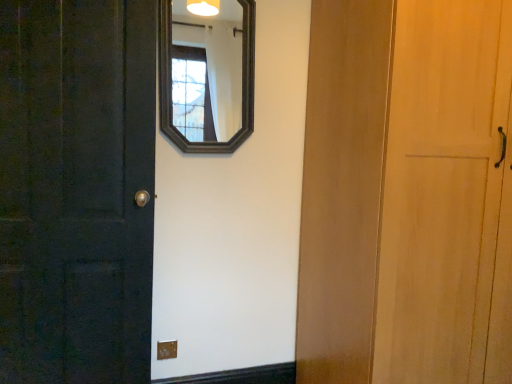
Question: Considering the relative sizes of matte black door at left and matte brown outlet at lower center in the image provided, is matte black door at left smaller than matte brown outlet at lower center?

Choices:
 (A) yes
 (B) no

Answer: (B)

Question: Does matte black door at left have a larger size compared to matte brown outlet at lower center?

Choices:
 (A) yes
 (B) no

Answer: (A)

Question: Considering the relative sizes of matte black door at left and matte brown outlet at lower center in the image provided, is matte black door at left taller than matte brown outlet at lower center?

Choices:
 (A) no
 (B) yes

Answer: (B)

Question: Can you confirm if matte black door at left is positioned to the left of matte brown outlet at lower center?

Choices:
 (A) no
 (B) yes

Answer: (B)

Question: From the image's perspective, is matte black door at left on top of matte brown outlet at lower center?

Choices:
 (A) yes
 (B) no

Answer: (A)

Question: In the image, is matte brown outlet at lower center positioned in front of or behind dark wood mirror at upper center?

Choices:
 (A) behind
 (B) front

Answer: (A)

Question: From a real-world perspective, is matte brown outlet at lower center physically located above or below dark wood mirror at upper center?

Choices:
 (A) above
 (B) below

Answer: (B)

Question: Is matte brown outlet at lower center to the left or to the right of dark wood mirror at upper center in the image?

Choices:
 (A) left
 (B) right

Answer: (A)

Question: Considering the positions of point (176, 344) and point (224, 59), is point (176, 344) closer or farther from the camera than point (224, 59)?

Choices:
 (A) closer
 (B) farther

Answer: (A)

Question: Is matte black door at left bigger or smaller than matte brown outlet at lower center?

Choices:
 (A) big
 (B) small

Answer: (A)

Question: Do you think matte black door at left is within matte brown outlet at lower center, or outside of it?

Choices:
 (A) inside
 (B) outside

Answer: (B)

Question: Considering the positions of matte black door at left and matte brown outlet at lower center in the image, is matte black door at left wider or thinner than matte brown outlet at lower center?

Choices:
 (A) thin
 (B) wide

Answer: (B)

Question: In the image, is matte black door at left on the left side or the right side of matte brown outlet at lower center?

Choices:
 (A) right
 (B) left

Answer: (B)

Question: Is matte brown outlet at lower center taller or shorter than matte black door at left?

Choices:
 (A) tall
 (B) short

Answer: (B)

Question: From the image's perspective, is matte brown outlet at lower center above or below matte black door at left?

Choices:
 (A) above
 (B) below

Answer: (B)